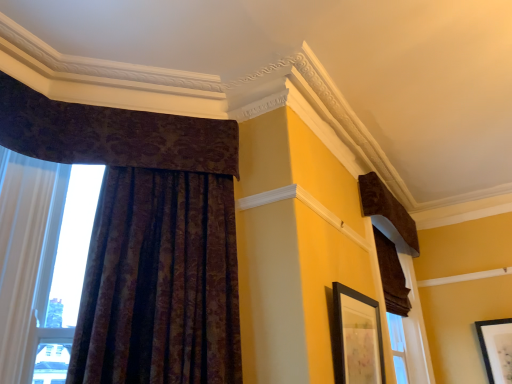
Question: From the image's perspective, is black matte picture frame at center, the second picture frame positioned from the bottom, under velvet brown curtain at upper right, which is counted as the 4th curtain, starting from the left?

Choices:
 (A) yes
 (B) no

Answer: (A)

Question: From the image's perspective, is black matte picture frame at center, the 2th picture frame in the right-to-left sequence, above velvet brown curtain at upper right, which is counted as the 4th curtain, starting from the left?

Choices:
 (A) yes
 (B) no

Answer: (B)

Question: Is black matte picture frame at center, the 2th picture frame in the right-to-left sequence, to the left of velvet brown curtain at upper right, marked as the first curtain in a right-to-left arrangement, from the viewer's perspective?

Choices:
 (A) no
 (B) yes

Answer: (B)

Question: Is black matte picture frame at center, arranged as the 1th picture frame when viewed from the front, wider than velvet brown curtain at upper right, marked as the first curtain in a right-to-left arrangement?

Choices:
 (A) no
 (B) yes

Answer: (A)

Question: Considering the relative sizes of black matte picture frame at center, the second picture frame positioned from the bottom, and velvet brown curtain at upper right, marked as the first curtain in a right-to-left arrangement, in the image provided, is black matte picture frame at center, the second picture frame positioned from the bottom, bigger than velvet brown curtain at upper right, marked as the first curtain in a right-to-left arrangement,?

Choices:
 (A) no
 (B) yes

Answer: (A)

Question: Is black matte picture frame at center, arranged as the first picture frame when viewed from the left, surrounding velvet brown curtain at upper right, which is counted as the 4th curtain, starting from the left?

Choices:
 (A) yes
 (B) no

Answer: (B)

Question: From the image's perspective, would you say velvet-like brown curtain at left, the 4th curtain when ordered from right to left, is positioned over black matte picture frame at center, the 2th picture frame in the right-to-left sequence?

Choices:
 (A) no
 (B) yes

Answer: (B)

Question: Is velvet-like brown curtain at left, the 4th curtain when ordered from right to left, at the left side of black matte picture frame at center, the second picture frame when ordered from back to front?

Choices:
 (A) no
 (B) yes

Answer: (B)

Question: Considering the relative sizes of velvet-like brown curtain at left, the 4th curtain when ordered from right to left, and black matte picture frame at center, which ranks as the first picture frame in top-to-bottom order, in the image provided, is velvet-like brown curtain at left, the 4th curtain when ordered from right to left, smaller than black matte picture frame at center, which ranks as the first picture frame in top-to-bottom order,?

Choices:
 (A) yes
 (B) no

Answer: (B)

Question: Is velvet-like brown curtain at left, the 4th curtain when ordered from right to left, shorter than black matte picture frame at center, the 2th picture frame in the right-to-left sequence?

Choices:
 (A) yes
 (B) no

Answer: (B)

Question: Is the depth of velvet-like brown curtain at left, which appears as the first curtain when viewed from the left, greater than that of black matte picture frame at center, the second picture frame positioned from the bottom?

Choices:
 (A) no
 (B) yes

Answer: (A)

Question: Considering the relative sizes of velvet-like brown curtain at left, the 4th curtain when ordered from right to left, and black matte picture frame at center, arranged as the first picture frame when viewed from the left, in the image provided, is velvet-like brown curtain at left, the 4th curtain when ordered from right to left, bigger than black matte picture frame at center, arranged as the first picture frame when viewed from the left,?

Choices:
 (A) no
 (B) yes

Answer: (B)

Question: Is dark velvet curtain at upper left, the second curtain when ordered from left to right, oriented towards brown velvet curtain at right, which ranks as the 3th curtain in left-to-right order?

Choices:
 (A) no
 (B) yes

Answer: (A)